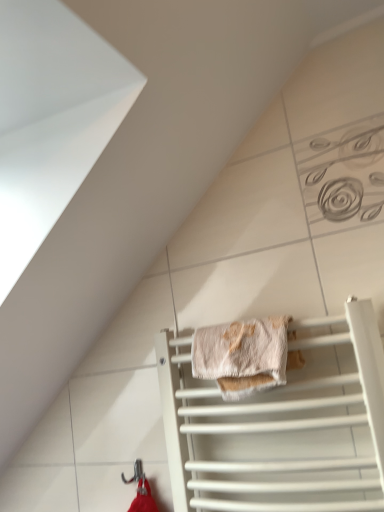
The height and width of the screenshot is (512, 384). I want to click on metallic hook at lower center, so click(x=135, y=473).

From the image's perspective, which one is positioned higher, beige textured towel at center or white matte towel rack at lower center?

From the image's view, beige textured towel at center is above.

Consider the image. Which of these two, beige textured towel at center or white matte towel rack at lower center, is bigger?

white matte towel rack at lower center.

In the image, there is a white matte towel rack at lower center. Identify the location of material above it (from the image's perspective). This screenshot has height=512, width=384. (242, 355).

Is beige textured towel at center not inside white matte towel rack at lower center?

Actually, beige textured towel at center is within white matte towel rack at lower center.

Could you tell me if metallic hook at lower center is facing beige textured towel at center?

No, metallic hook at lower center does not turn towards beige textured towel at center.

How different are the orientations of metallic hook at lower center and beige textured towel at center in degrees?

0.0114 degrees separate the facing orientations of metallic hook at lower center and beige textured towel at center.

In the scene shown: From the image's perspective, which one is positioned higher, metallic hook at lower center or beige textured towel at center?

beige textured towel at center is shown above in the image.

Considering the sizes of objects metallic hook at lower center and beige textured towel at center in the image provided, who is thinner, metallic hook at lower center or beige textured towel at center?

Thinner between the two is metallic hook at lower center.

In the scene shown: Does beige textured towel at center lie in front of metallic hook at lower center?

Yes, beige textured towel at center is closer to the camera.

Is beige textured towel at center wider than metallic hook at lower center?

Yes.

Which point is more distant from viewer, (214, 368) or (140, 473)?

The point (140, 473) is more distant.

Is beige textured towel at center shorter than metallic hook at lower center?

No.

Is point (204, 418) positioned before point (135, 473)?

Yes, it is in front of point (135, 473).

Does white matte towel rack at lower center turn towards metallic hook at lower center?

No.

Looking at this image, is white matte towel rack at lower center taller than metallic hook at lower center?

Yes, white matte towel rack at lower center is taller than metallic hook at lower center.

Would you say white matte towel rack at lower center is part of metallic hook at lower center's contents?

No, metallic hook at lower center does not contain white matte towel rack at lower center.

Is metallic hook at lower center next to white matte towel rack at lower center and touching it?

No, metallic hook at lower center is not making contact with white matte towel rack at lower center.

Considering the sizes of objects metallic hook at lower center and white matte towel rack at lower center in the image provided, who is taller, metallic hook at lower center or white matte towel rack at lower center?

white matte towel rack at lower center is taller.

The width and height of the screenshot is (384, 512). I want to click on material on the left side of white matte towel rack at lower center, so click(242, 355).

Would you say white matte towel rack at lower center is inside or outside beige textured towel at center?

The correct answer is: outside.

Is white matte towel rack at lower center positioned with its back to beige textured towel at center?

That's right, white matte towel rack at lower center is facing away from beige textured towel at center.

In terms of width, does white matte towel rack at lower center look wider or thinner when compared to beige textured towel at center?

Considering their sizes, white matte towel rack at lower center looks slimmer than beige textured towel at center.

I want to click on cage that is in front of the beige textured towel at center, so click(x=278, y=428).

Identify the location of material above the metallic hook at lower center (from a real-world perspective). (242, 355).

When comparing their distances from beige textured towel at center, does metallic hook at lower center or white matte towel rack at lower center seem closer?

Among the two, white matte towel rack at lower center is located nearer to beige textured towel at center.

Based on their spatial positions, is beige textured towel at center or metallic hook at lower center further from white matte towel rack at lower center?

Among the two, metallic hook at lower center is located further to white matte towel rack at lower center.

Looking at the image, which one is located further to metallic hook at lower center, white matte towel rack at lower center or beige textured towel at center?

Based on the image, beige textured towel at center appears to be further to metallic hook at lower center.

Estimate the real-world distances between objects in this image. Which object is closer to white matte towel rack at lower center, metallic hook at lower center or beige textured towel at center?

beige textured towel at center is closer to white matte towel rack at lower center.

Which object lies further to the anchor point metallic hook at lower center, beige textured towel at center or white matte towel rack at lower center?

Among the two, beige textured towel at center is located further to metallic hook at lower center.

Looking at the image, which one is located closer to beige textured towel at center, white matte towel rack at lower center or metallic hook at lower center?

white matte towel rack at lower center.

Where is `material located between white matte towel rack at lower center and metallic hook at lower center in the depth direction`? Image resolution: width=384 pixels, height=512 pixels. material located between white matte towel rack at lower center and metallic hook at lower center in the depth direction is located at coordinates (242, 355).